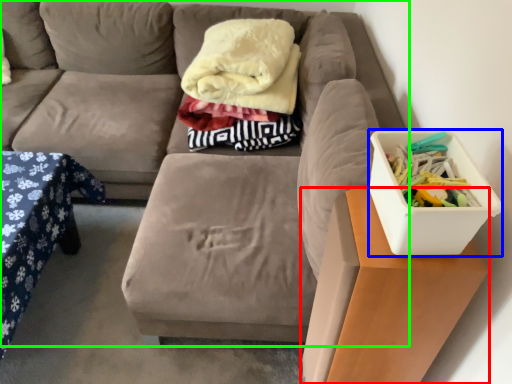
Question: Which object is the closest to the table (highlighted by a red box)? Choose among these: storage box (highlighted by a blue box) or studio couch (highlighted by a green box).

Choices:
 (A) storage box
 (B) studio couch

Answer: (A)